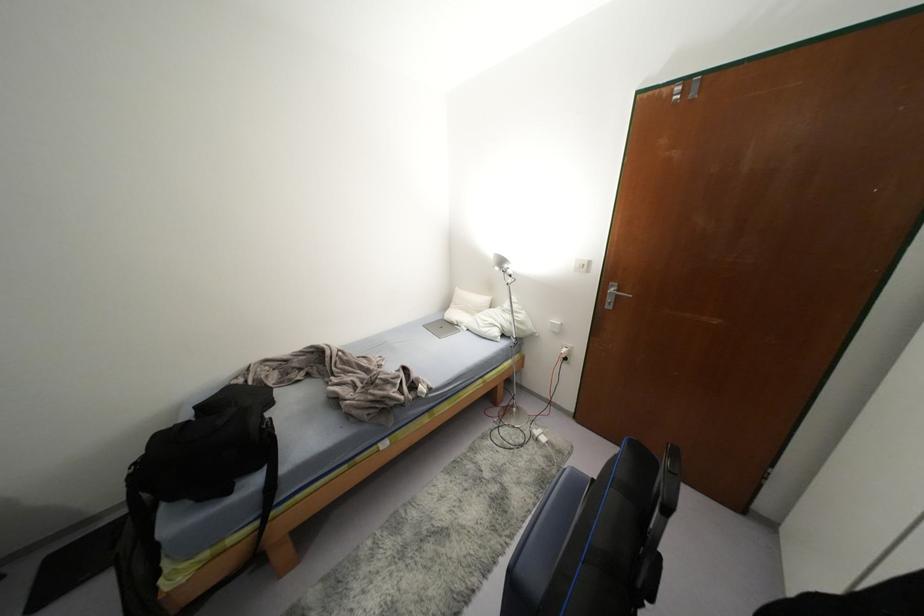
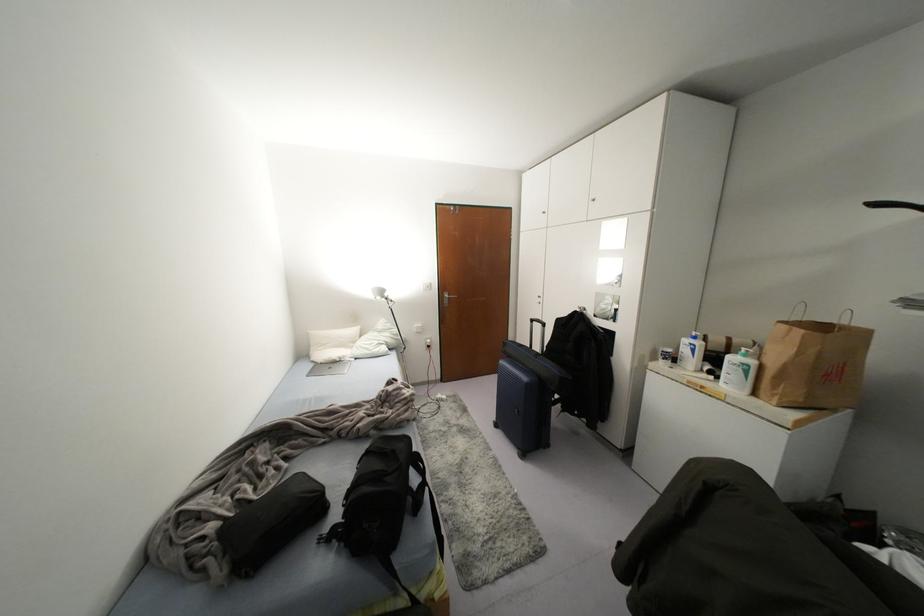
In the second image, find the point that corresponds to (x=505, y=265) in the first image.

(385, 294)